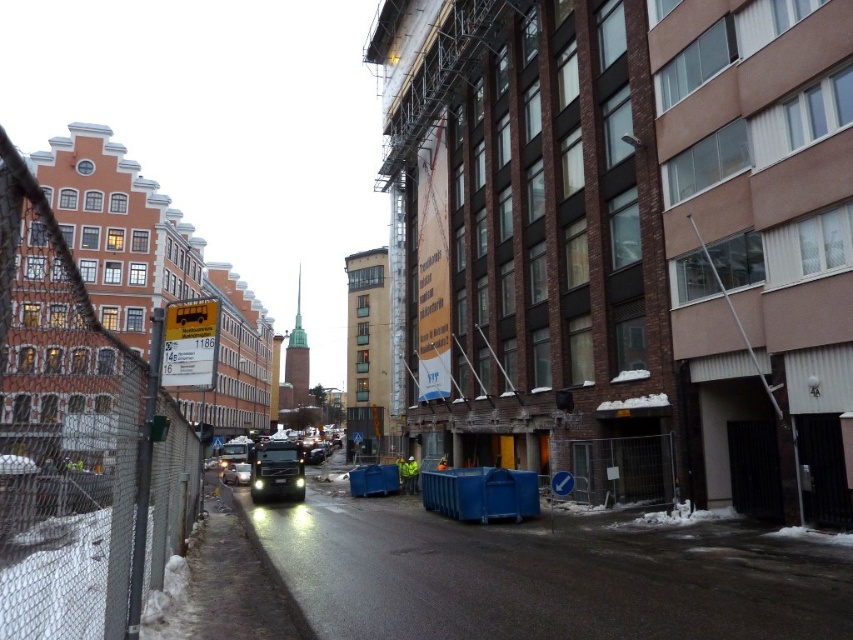
Question: Which of the following is the closest to the observer?

Choices:
 (A) (73, 275)
 (B) (247, 476)

Answer: (A)

Question: Is metallic chain-link fence at left closer to the viewer compared to shiny silver car at center?

Choices:
 (A) yes
 (B) no

Answer: (A)

Question: Which point is closer to the camera taking this photo?

Choices:
 (A) (241, 468)
 (B) (123, 561)

Answer: (B)

Question: Is metallic chain-link fence at left positioned in front of shiny silver car at center?

Choices:
 (A) no
 (B) yes

Answer: (B)

Question: Is metallic chain-link fence at left thinner than shiny silver car at center?

Choices:
 (A) no
 (B) yes

Answer: (A)

Question: Among these points, which one is farthest from the camera?

Choices:
 (A) (160, 556)
 (B) (248, 465)

Answer: (B)